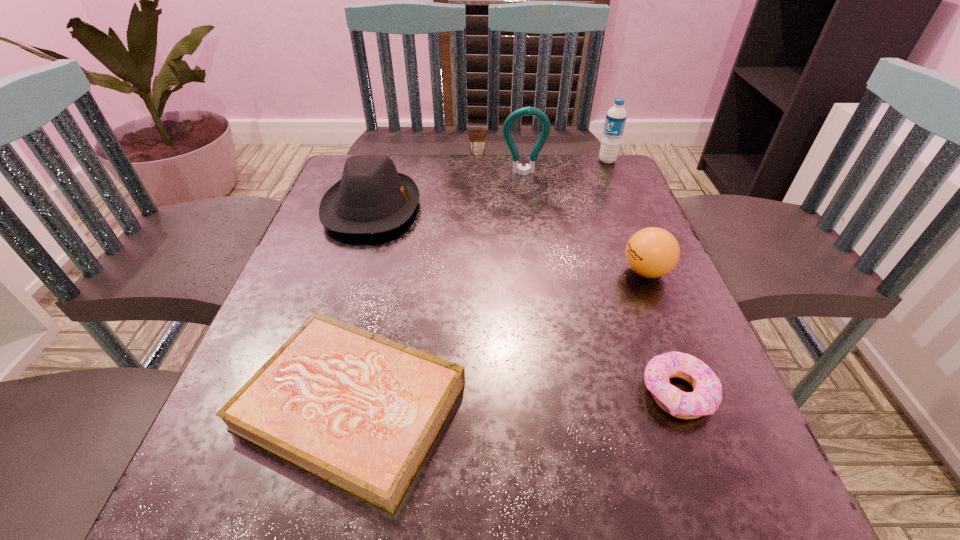
Where is `blank area at the right edge`? This screenshot has width=960, height=540. blank area at the right edge is located at coordinates (622, 386).

Locate an element on the screen. Image resolution: width=960 pixels, height=540 pixels. free location at the near left corner is located at coordinates (187, 514).

Identify the location of vacant region at the far right corner of the desktop. This screenshot has height=540, width=960. (596, 194).

At what (x,y) coordinates should I click in order to perform the action: click on vacant space at the near right corner. Please return your answer as a coordinate pair (x, y). This screenshot has height=540, width=960. Looking at the image, I should click on (672, 489).

Where is `empty space that is in between the hardback book and the second farthest object`? This screenshot has height=540, width=960. empty space that is in between the hardback book and the second farthest object is located at coordinates (438, 289).

At what (x,y) coordinates should I click in order to perform the action: click on empty location between the doughnut and the hardback book. Please return your answer as a coordinate pair (x, y). The width and height of the screenshot is (960, 540). Looking at the image, I should click on (515, 399).

In order to click on free space between the hardback book and the farthest object in this screenshot , I will do `click(479, 283)`.

The width and height of the screenshot is (960, 540). What are the coordinates of `empty space between the bottle opener and the farthest object` in the screenshot? It's located at (565, 167).

Identify the location of free space between the fifth nearest object and the fourth farthest object. The height and width of the screenshot is (540, 960). (585, 222).

Find the location of a particular element. The image size is (960, 540). vacant region between the doughnut and the bottle opener is located at coordinates click(x=600, y=283).